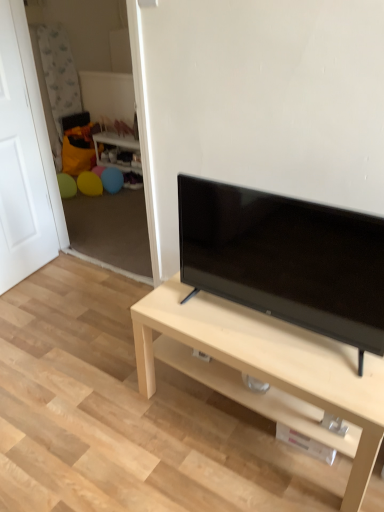
Where is `vacant space to the right of white matte door at left`? vacant space to the right of white matte door at left is located at coordinates (76, 282).